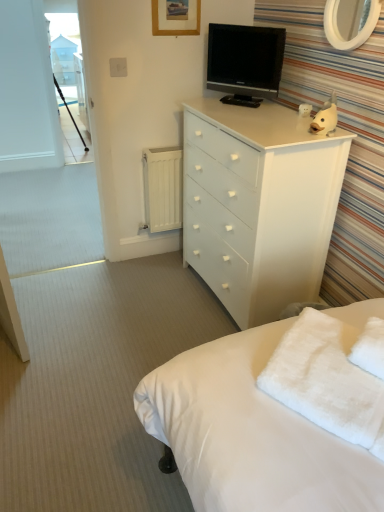
Question: From a real-world perspective, is white glossy mirror at upper right below black glossy tv at upper center?

Choices:
 (A) no
 (B) yes

Answer: (A)

Question: Could you tell me if white glossy mirror at upper right is facing black glossy tv at upper center?

Choices:
 (A) no
 (B) yes

Answer: (A)

Question: From the image's perspective, is white glossy mirror at upper right beneath black glossy tv at upper center?

Choices:
 (A) yes
 (B) no

Answer: (A)

Question: From the image's perspective, is white glossy mirror at upper right located above black glossy tv at upper center?

Choices:
 (A) no
 (B) yes

Answer: (A)

Question: Is white glossy mirror at upper right completely or partially outside of black glossy tv at upper center?

Choices:
 (A) yes
 (B) no

Answer: (A)

Question: Looking at their shapes, would you say transparent glass window screen at upper left is wider or thinner than white glossy chest of drawers at upper right?

Choices:
 (A) thin
 (B) wide

Answer: (A)

Question: Would you say transparent glass window screen at upper left is to the left or to the right of white glossy chest of drawers at upper right in the picture?

Choices:
 (A) right
 (B) left

Answer: (B)

Question: Is transparent glass window screen at upper left in front of or behind white glossy chest of drawers at upper right in the image?

Choices:
 (A) front
 (B) behind

Answer: (B)

Question: Is transparent glass window screen at upper left inside or outside of white glossy chest of drawers at upper right?

Choices:
 (A) inside
 (B) outside

Answer: (B)

Question: Which is correct: white fluffy towel at lower right is inside white painted metal radiator at lower left, or outside of it?

Choices:
 (A) inside
 (B) outside

Answer: (B)

Question: In the image, is white fluffy towel at lower right on the left side or the right side of white painted metal radiator at lower left?

Choices:
 (A) right
 (B) left

Answer: (A)

Question: Is white fluffy towel at lower right bigger or smaller than white painted metal radiator at lower left?

Choices:
 (A) big
 (B) small

Answer: (B)

Question: From the image's perspective, relative to white painted metal radiator at lower left, is white fluffy towel at lower right above or below?

Choices:
 (A) below
 (B) above

Answer: (A)

Question: Considering the positions of white fluffy towel at lower right and white glossy chest of drawers at upper right in the image, is white fluffy towel at lower right wider or thinner than white glossy chest of drawers at upper right?

Choices:
 (A) thin
 (B) wide

Answer: (A)

Question: Is white fluffy towel at lower right bigger or smaller than white glossy chest of drawers at upper right?

Choices:
 (A) small
 (B) big

Answer: (A)